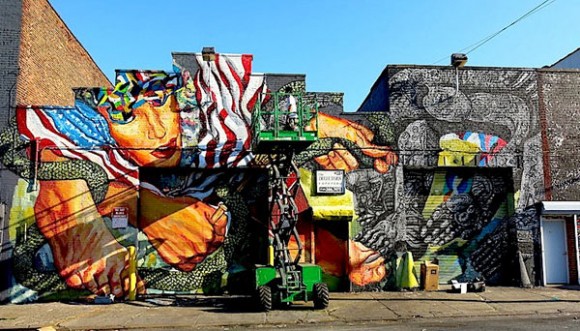
Find the location of a particular element. This screenshot has height=331, width=580. door is located at coordinates (325, 250), (554, 257).